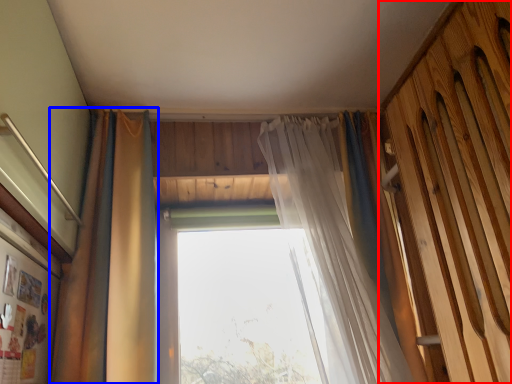
Question: Which point is further to the camera, barn door (highlighted by a red box) or curtain (highlighted by a blue box)?

Choices:
 (A) barn door
 (B) curtain

Answer: (B)